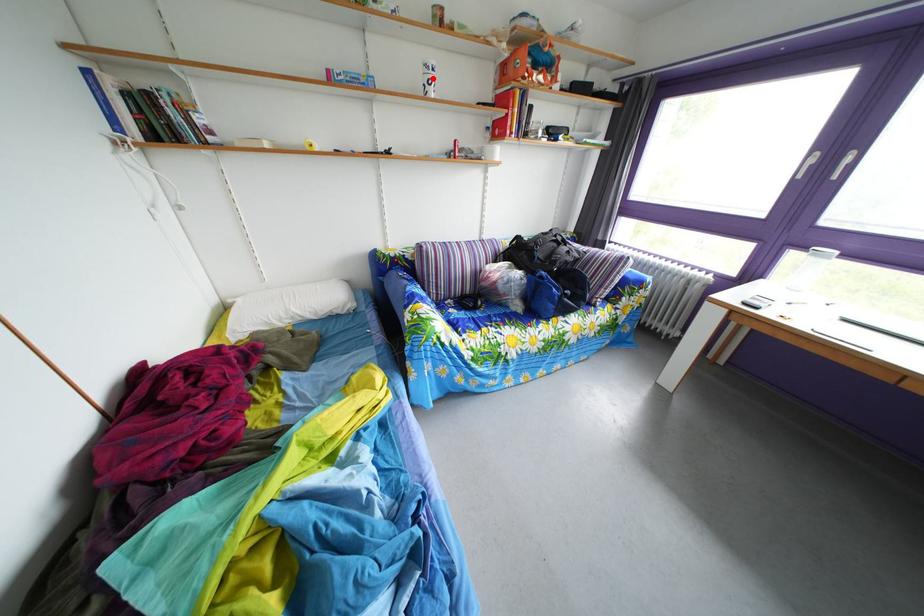
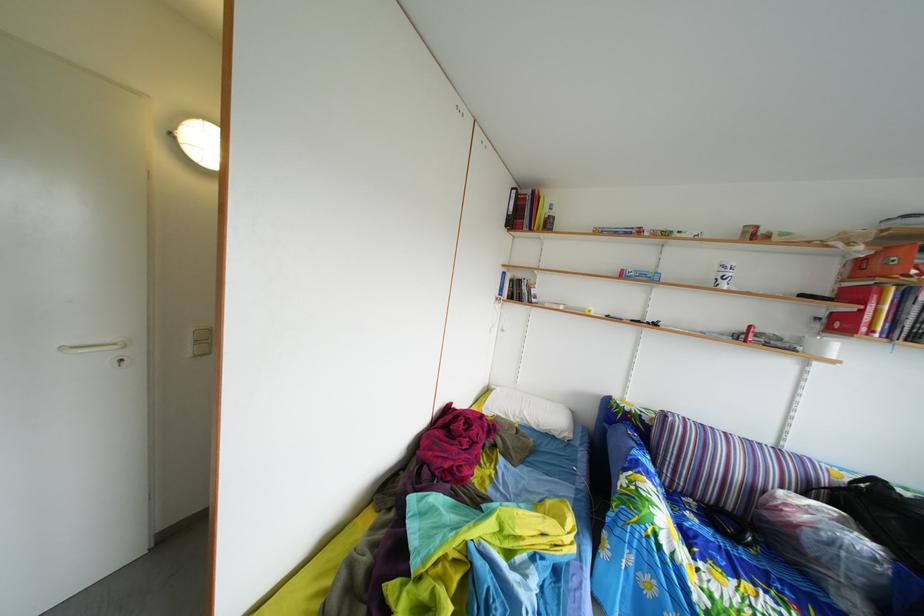
Locate, in the second image, the point that corresponds to the highlighted location in the first image.

(727, 276)